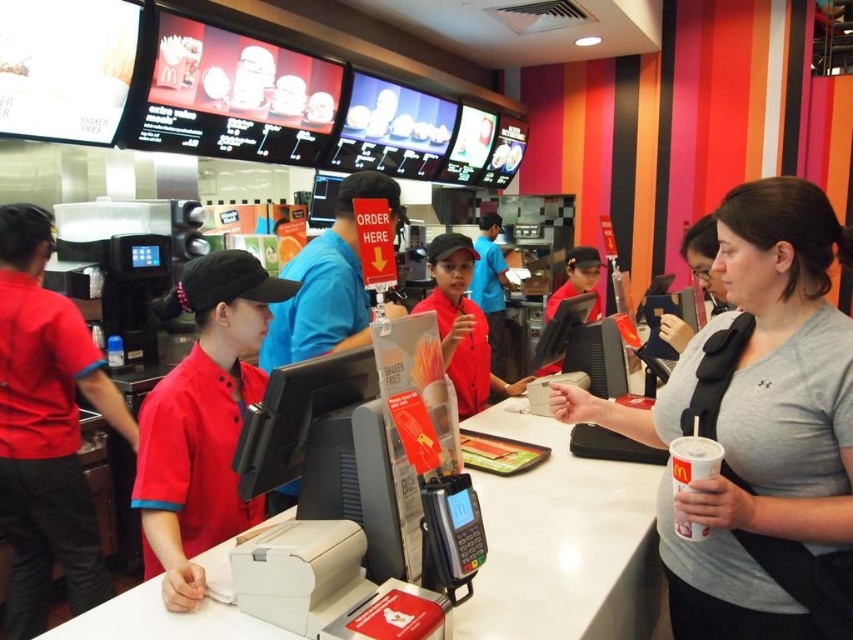
Between gray matte shirt at center and white paper cup at lower right, which one has less height?

white paper cup at lower right

Is gray matte shirt at center shorter than white paper cup at lower right?

In fact, gray matte shirt at center may be taller than white paper cup at lower right.

Between point (746, 324) and point (680, 442), which one is positioned behind?

Positioned behind is point (746, 324).

At what (x,y) coordinates should I click in order to perform the action: click on gray matte shirt at center. Please return your answer as a coordinate pair (x, y). The image size is (853, 640). Looking at the image, I should click on (759, 429).